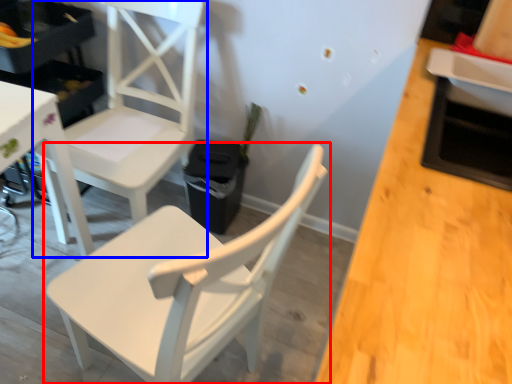
Question: Which point is further to the camera, chair (highlighted by a red box) or chair (highlighted by a blue box)?

Choices:
 (A) chair
 (B) chair

Answer: (B)